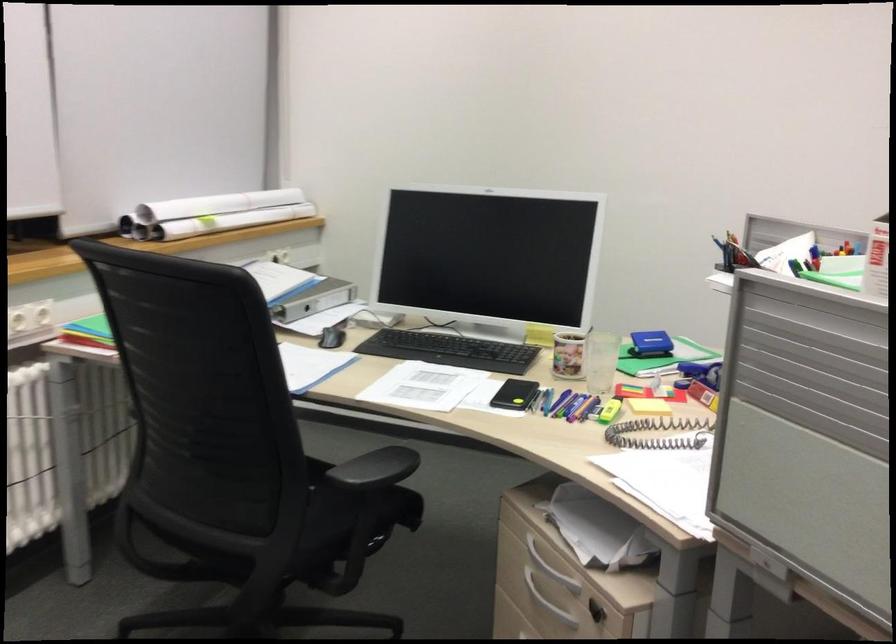
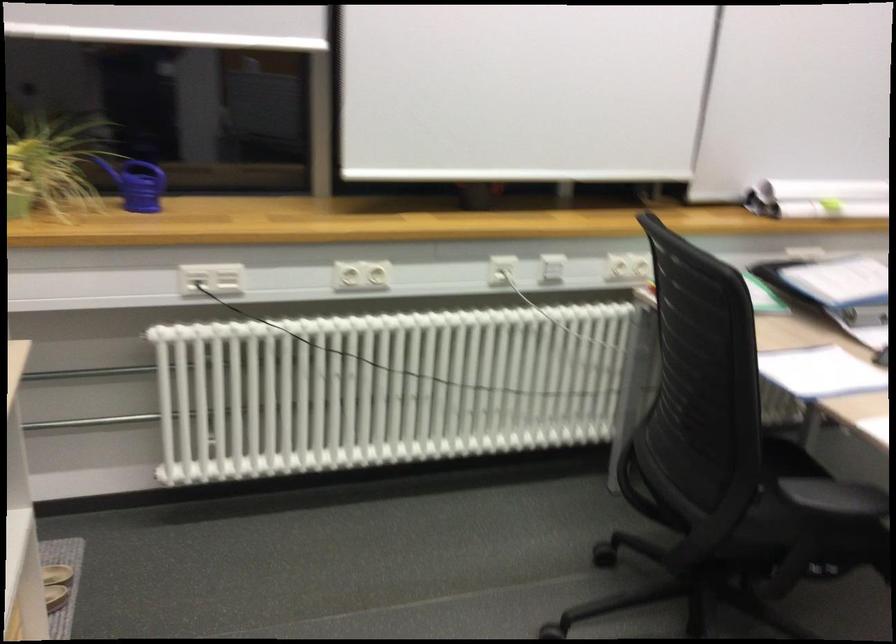
Question: The camera is either moving clockwise (left) or counter-clockwise (right) around the object. The first image is from the beginning of the video and the second image is from the end. Is the camera moving left or right when shooting the video?

Choices:
 (A) Left
 (B) Right

Answer: (B)